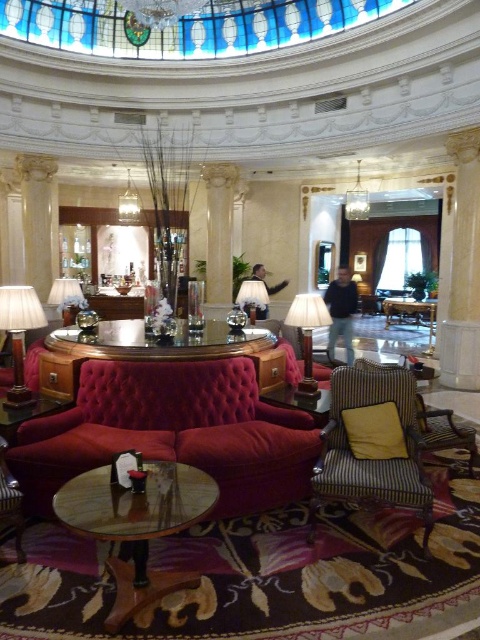
Question: Estimate the real-world distances between objects in this image. Which object is farther from the striped fabric armchair at center?

Choices:
 (A) clear glass chandelier at upper center
 (B) matte silver lamp at center

Answer: (A)

Question: Which of the following is the farthest from the observer?

Choices:
 (A) (327, 493)
 (B) (289, 310)
 (C) (15, 512)

Answer: (B)

Question: Can you confirm if matte orange lampshade at left is bigger than matte silver lamp at center?

Choices:
 (A) no
 (B) yes

Answer: (A)

Question: Considering the real-world distances, which object is farthest from the matte gold lampshade at upper center?

Choices:
 (A) matte beige lamp at center
 (B) velvet red armchair at lower left
 (C) striped fabric armchair at center
 (D) velvet red couch at center

Answer: (B)

Question: Does matte orange lampshade at left appear on the left side of matte gold lampshade at upper center?

Choices:
 (A) yes
 (B) no

Answer: (B)

Question: Does matte orange lampshade at left have a smaller size compared to clear glass chandelier at upper center?

Choices:
 (A) yes
 (B) no

Answer: (A)